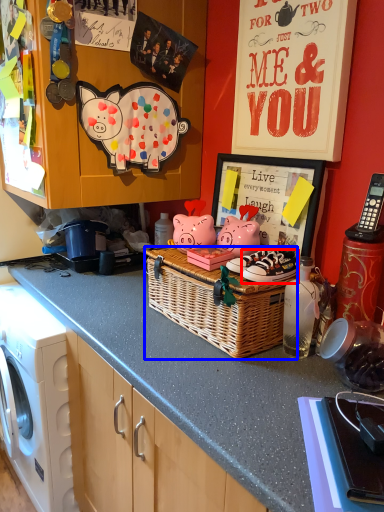
Question: Which object appears farthest to the camera in this image, footwear (highlighted by a red box) or picnic basket (highlighted by a blue box)?

Choices:
 (A) footwear
 (B) picnic basket

Answer: (A)